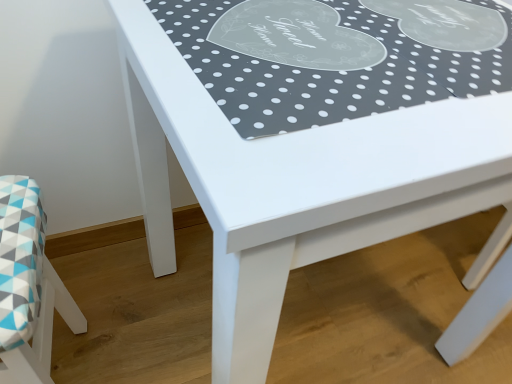
Question: Looking at the image, does polka dot fabric placemat at upper center seem bigger or smaller compared to geometric fabric cushion at lower left?

Choices:
 (A) big
 (B) small

Answer: (B)

Question: From the image's perspective, is polka dot fabric placemat at upper center located above or below geometric fabric cushion at lower left?

Choices:
 (A) below
 (B) above

Answer: (B)

Question: In the image, is polka dot fabric placemat at upper center on the left side or the right side of geometric fabric cushion at lower left?

Choices:
 (A) right
 (B) left

Answer: (A)

Question: In the image, is geometric fabric cushion at lower left on the left side or the right side of polka dot fabric placemat at upper center?

Choices:
 (A) right
 (B) left

Answer: (B)

Question: Considering their positions, is geometric fabric cushion at lower left located in front of or behind polka dot fabric placemat at upper center?

Choices:
 (A) front
 (B) behind

Answer: (B)

Question: From a real-world perspective, is geometric fabric cushion at lower left positioned above or below polka dot fabric placemat at upper center?

Choices:
 (A) below
 (B) above

Answer: (A)

Question: In terms of size, does geometric fabric cushion at lower left appear bigger or smaller than polka dot fabric placemat at upper center?

Choices:
 (A) big
 (B) small

Answer: (A)